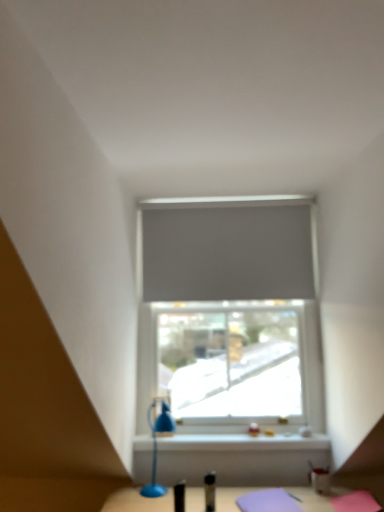
This screenshot has width=384, height=512. Describe the element at coordinates (227, 252) in the screenshot. I see `gray matte curtain at center` at that location.

The width and height of the screenshot is (384, 512). Find the location of `blue plastic table lamp at lower center`. blue plastic table lamp at lower center is located at coordinates (156, 444).

The width and height of the screenshot is (384, 512). I want to click on gray matte curtain at center, so click(x=227, y=252).

Is gray matte curtain at center positioned with its back to matte gray roller blind at center?

Absolutely, gray matte curtain at center is directed away from matte gray roller blind at center.

Is gray matte curtain at center shorter than matte gray roller blind at center?

Indeed, gray matte curtain at center has a lesser height compared to matte gray roller blind at center.

Does gray matte curtain at center have a larger size compared to matte gray roller blind at center?

No, gray matte curtain at center is not bigger than matte gray roller blind at center.

From the image's perspective, who appears lower, matte gray roller blind at center or gray matte curtain at center?

matte gray roller blind at center is shown below in the image.

Considering the relative sizes of matte gray roller blind at center and gray matte curtain at center in the image provided, is matte gray roller blind at center taller than gray matte curtain at center?

Yes.

How much distance is there between matte gray roller blind at center and gray matte curtain at center?

matte gray roller blind at center and gray matte curtain at center are 4.42 inches apart from each other.

Between matte gray roller blind at center and blue plastic table lamp at lower center, which one is positioned behind?

Positioned behind is matte gray roller blind at center.

Would you say matte gray roller blind at center is a long distance from blue plastic table lamp at lower center?

They are positioned close to each other.

Looking at the image, does matte gray roller blind at center seem bigger or smaller compared to blue plastic table lamp at lower center?

In the image, matte gray roller blind at center appears to be larger than blue plastic table lamp at lower center.

How distant is matte gray roller blind at center from blue plastic table lamp at lower center?

matte gray roller blind at center is 24.17 inches from blue plastic table lamp at lower center.

Is blue plastic table lamp at lower center turned away from matte gray roller blind at center?

Absolutely, blue plastic table lamp at lower center is directed away from matte gray roller blind at center.

Which of these two, blue plastic table lamp at lower center or matte gray roller blind at center, is thinner?

matte gray roller blind at center is thinner.

Is matte gray roller blind at center inside blue plastic table lamp at lower center?

No, matte gray roller blind at center is not inside blue plastic table lamp at lower center.

From a real-world perspective, is blue plastic table lamp at lower center on matte gray roller blind at center?

No, from a real-world perspective, blue plastic table lamp at lower center is not over matte gray roller blind at center

Which is behind, blue plastic table lamp at lower center or gray matte curtain at center?

gray matte curtain at center is more distant.

Which is farther from the camera, (151, 422) or (297, 291)?

The point (297, 291) is more distant.

Is blue plastic table lamp at lower center spatially inside gray matte curtain at center, or outside of it?

blue plastic table lamp at lower center lies outside gray matte curtain at center.

Consider the image. Between gray matte curtain at center and blue plastic table lamp at lower center, which one has larger width?

blue plastic table lamp at lower center is wider.

Which object is positioned more to the right, gray matte curtain at center or blue plastic table lamp at lower center?

gray matte curtain at center.

Consider the image. Can you confirm if gray matte curtain at center is shorter than blue plastic table lamp at lower center?

In fact, gray matte curtain at center may be taller than blue plastic table lamp at lower center.

Measure the distance from gray matte curtain at center to blue plastic table lamp at lower center.

The distance of gray matte curtain at center from blue plastic table lamp at lower center is 34.39 inches.

Identify the location of curtain on the right of matte gray roller blind at center. (227, 252).

Where is `window below the gray matte curtain at center (from the image's perspective)`? window below the gray matte curtain at center (from the image's perspective) is located at coordinates (230, 311).

Based on their spatial positions, is blue plastic table lamp at lower center or gray matte curtain at center closer to matte gray roller blind at center?

gray matte curtain at center lies closer to matte gray roller blind at center than the other object.

Looking at the image, which one is located further to blue plastic table lamp at lower center, matte gray roller blind at center or gray matte curtain at center?

gray matte curtain at center lies further to blue plastic table lamp at lower center than the other object.

Considering their positions, is gray matte curtain at center positioned further to matte gray roller blind at center than blue plastic table lamp at lower center?

blue plastic table lamp at lower center.

Looking at the image, which one is located further to gray matte curtain at center, blue plastic table lamp at lower center or matte gray roller blind at center?

Among the two, blue plastic table lamp at lower center is located further to gray matte curtain at center.

Based on their spatial positions, is gray matte curtain at center or matte gray roller blind at center further from blue plastic table lamp at lower center?

gray matte curtain at center lies further to blue plastic table lamp at lower center than the other object.

Which object lies further to the anchor point gray matte curtain at center, matte gray roller blind at center or blue plastic table lamp at lower center?

blue plastic table lamp at lower center is further to gray matte curtain at center.

You are a GUI agent. You are given a task and a screenshot of the screen. Output one action in this format:
    pyautogui.click(x=<x>, y=<y>)
    Task: Click on the window between gray matte curtain at center and blue plastic table lamp at lower center in the vertical direction
    This screenshot has width=384, height=512.
    Given the screenshot: What is the action you would take?
    [230, 311]